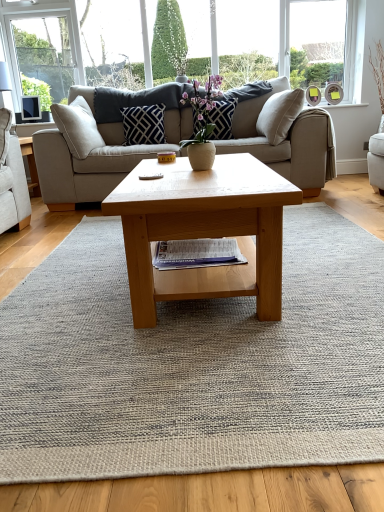
Describe the element at coordinates (76, 30) in the screenshot. The width and height of the screenshot is (384, 512). I see `white textured bay window at upper right` at that location.

How much space does matte black pillow at center, which ranks as the 1th pillow in right-to-left order, occupy horizontally?

It is 9.82 inches.

The width and height of the screenshot is (384, 512). Describe the element at coordinates (220, 118) in the screenshot. I see `matte black pillow at center, which ranks as the 1th pillow in right-to-left order` at that location.

What is the approximate height of neutral woven rug at center?

neutral woven rug at center is 3.79 centimeters tall.

What do you see at coordinates (204, 230) in the screenshot?
I see `light brown wooden coffee table at center` at bounding box center [204, 230].

Locate an element on the screen. beige fabric couch at center is located at coordinates (95, 152).

What's the angular difference between matte black pillow at center, arranged as the 2th pillow when viewed from the left, and navy blue textured pillow at upper center, which ranks as the second pillow in right-to-left order,'s facing directions?

The facing directions of matte black pillow at center, arranged as the 2th pillow when viewed from the left, and navy blue textured pillow at upper center, which ranks as the second pillow in right-to-left order, are 0.00155 degrees apart.

From the image's perspective, which object appears higher, matte black pillow at center, which ranks as the 1th pillow in right-to-left order, or navy blue textured pillow at upper center, positioned as the 1th pillow in left-to-right order?

matte black pillow at center, which ranks as the 1th pillow in right-to-left order.

Is matte black pillow at center, which ranks as the 1th pillow in right-to-left order, wider or thinner than navy blue textured pillow at upper center, positioned as the 1th pillow in left-to-right order?

matte black pillow at center, which ranks as the 1th pillow in right-to-left order, is thinner than navy blue textured pillow at upper center, positioned as the 1th pillow in left-to-right order.

Could you measure the distance between matte black pillow at center, arranged as the 2th pillow when viewed from the left, and navy blue textured pillow at upper center, which ranks as the second pillow in right-to-left order?

matte black pillow at center, arranged as the 2th pillow when viewed from the left, is 17.73 inches away from navy blue textured pillow at upper center, which ranks as the second pillow in right-to-left order.

Is navy blue textured pillow at upper center, which ranks as the second pillow in right-to-left order, far away from beige fabric couch at center?

No, navy blue textured pillow at upper center, which ranks as the second pillow in right-to-left order, is not far away from beige fabric couch at center.

What's the angular difference between navy blue textured pillow at upper center, which ranks as the second pillow in right-to-left order, and beige fabric couch at center's facing directions?

navy blue textured pillow at upper center, which ranks as the second pillow in right-to-left order, and beige fabric couch at center are facing 0.000763 degrees away from each other.

Between navy blue textured pillow at upper center, positioned as the 1th pillow in left-to-right order, and beige fabric couch at center, which one has smaller size?

navy blue textured pillow at upper center, positioned as the 1th pillow in left-to-right order, is smaller.

Which is more to the right, navy blue textured pillow at upper center, which ranks as the second pillow in right-to-left order, or beige fabric couch at center?

From the viewer's perspective, beige fabric couch at center appears more on the right side.

Which object is further away from the camera, matte black pillow at center, which ranks as the 1th pillow in right-to-left order, or white textured bay window at upper right?

white textured bay window at upper right is further from the camera.

In terms of height, does matte black pillow at center, which ranks as the 1th pillow in right-to-left order, look taller or shorter compared to white textured bay window at upper right?

In the image, matte black pillow at center, which ranks as the 1th pillow in right-to-left order, appears to be shorter than white textured bay window at upper right.

Between matte black pillow at center, arranged as the 2th pillow when viewed from the left, and white textured bay window at upper right, which one has larger size?

white textured bay window at upper right is bigger.

Does neutral woven rug at center contain white textured bay window at upper right?

No.

Which object is positioned more to the left, neutral woven rug at center or white textured bay window at upper right?

white textured bay window at upper right.

From a real-world perspective, which object stands above the other?

matte black pillow at center, which ranks as the 1th pillow in right-to-left order.

Is beige fabric couch at center next to matte black pillow at center, which ranks as the 1th pillow in right-to-left order, and touching it?

No, beige fabric couch at center is not with matte black pillow at center, which ranks as the 1th pillow in right-to-left order.

From the image's perspective, which is below, beige fabric couch at center or matte black pillow at center, which ranks as the 1th pillow in right-to-left order?

beige fabric couch at center appears lower in the image.

Can you tell me how much beige fabric couch at center and matte black pillow at center, which ranks as the 1th pillow in right-to-left order, differ in facing direction?

The facing directions of beige fabric couch at center and matte black pillow at center, which ranks as the 1th pillow in right-to-left order, are 0.000984 degrees apart.

Is neutral woven rug at center taller than beige fabric couch at center?

In fact, neutral woven rug at center may be shorter than beige fabric couch at center.

Considering the relative sizes of neutral woven rug at center and beige fabric couch at center in the image provided, is neutral woven rug at center wider than beige fabric couch at center?

Indeed, neutral woven rug at center has a greater width compared to beige fabric couch at center.

What's the angular difference between neutral woven rug at center and beige fabric couch at center's facing directions?

90.1 degrees separate the facing orientations of neutral woven rug at center and beige fabric couch at center.

Is point (208, 138) positioned after point (129, 276)?

Yes, point (208, 138) is farther from viewer.

Which is correct: matte black pillow at center, which ranks as the 1th pillow in right-to-left order, is inside light brown wooden coffee table at center, or outside of it?

matte black pillow at center, which ranks as the 1th pillow in right-to-left order, is located beyond the bounds of light brown wooden coffee table at center.

Are matte black pillow at center, arranged as the 2th pillow when viewed from the left, and light brown wooden coffee table at center making contact?

No, matte black pillow at center, arranged as the 2th pillow when viewed from the left, is not touching light brown wooden coffee table at center.

Considering the sizes of objects matte black pillow at center, which ranks as the 1th pillow in right-to-left order, and light brown wooden coffee table at center in the image provided, who is thinner, matte black pillow at center, which ranks as the 1th pillow in right-to-left order, or light brown wooden coffee table at center?

With smaller width is matte black pillow at center, which ranks as the 1th pillow in right-to-left order.

Locate an element on the screen. pillow above the navy blue textured pillow at upper center, positioned as the 1th pillow in left-to-right order (from the image's perspective) is located at coordinates (220, 118).

This screenshot has width=384, height=512. Identify the location of pillow that is the 1st object above the beige fabric couch at center (from a real-world perspective). (144, 124).

Looking at the image, which one is located further to beige fabric couch at center, neutral woven rug at center or white textured bay window at upper right?

white textured bay window at upper right is positioned further to the anchor beige fabric couch at center.

Considering their positions, is white textured bay window at upper right positioned further to beige fabric couch at center than neutral woven rug at center?

Based on the image, white textured bay window at upper right appears to be further to beige fabric couch at center.

Considering their positions, is beige fabric couch at center positioned further to white textured bay window at upper right than navy blue textured pillow at upper center, which ranks as the second pillow in right-to-left order?

beige fabric couch at center is positioned further to the anchor white textured bay window at upper right.

Estimate the real-world distances between objects in this image. Which object is further from beige fabric couch at center, light brown wooden coffee table at center or navy blue textured pillow at upper center, positioned as the 1th pillow in left-to-right order?

Among the two, light brown wooden coffee table at center is located further to beige fabric couch at center.

Estimate the real-world distances between objects in this image. Which object is closer to navy blue textured pillow at upper center, positioned as the 1th pillow in left-to-right order, white textured bay window at upper right or neutral woven rug at center?

The object closer to navy blue textured pillow at upper center, positioned as the 1th pillow in left-to-right order, is neutral woven rug at center.

Estimate the real-world distances between objects in this image. Which object is closer to beige fabric couch at center, neutral woven rug at center or light brown wooden coffee table at center?

light brown wooden coffee table at center is positioned closer to the anchor beige fabric couch at center.

Looking at the image, which one is located further to neutral woven rug at center, matte black pillow at center, arranged as the 2th pillow when viewed from the left, or navy blue textured pillow at upper center, positioned as the 1th pillow in left-to-right order?

Among the two, navy blue textured pillow at upper center, positioned as the 1th pillow in left-to-right order, is located further to neutral woven rug at center.

Based on their spatial positions, is neutral woven rug at center or matte black pillow at center, which ranks as the 1th pillow in right-to-left order, further from light brown wooden coffee table at center?

Among the two, matte black pillow at center, which ranks as the 1th pillow in right-to-left order, is located further to light brown wooden coffee table at center.

Locate an element on the screen. studio couch located between light brown wooden coffee table at center and white textured bay window at upper right in the depth direction is located at coordinates (95, 152).

Locate an element on the screen. The image size is (384, 512). coffee table between neutral woven rug at center and matte black pillow at center, arranged as the 2th pillow when viewed from the left, from front to back is located at coordinates (204, 230).

Where is `coffee table positioned between neutral woven rug at center and white textured bay window at upper right from near to far`? The height and width of the screenshot is (512, 384). coffee table positioned between neutral woven rug at center and white textured bay window at upper right from near to far is located at coordinates (204, 230).

This screenshot has height=512, width=384. I want to click on pillow between neutral woven rug at center and navy blue textured pillow at upper center, positioned as the 1th pillow in left-to-right order, in the front-back direction, so click(x=220, y=118).